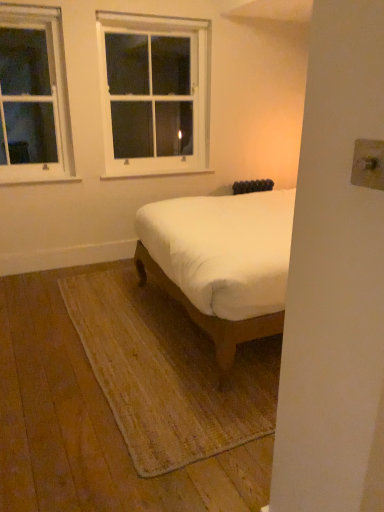
Question: Does white wood window at upper left, acting as the 1th window starting from the left, have a lesser height compared to white fabric bed at center?

Choices:
 (A) no
 (B) yes

Answer: (A)

Question: Considering the relative sizes of white wood window at upper left, which is counted as the second window, starting from the right, and white fabric bed at center in the image provided, is white wood window at upper left, which is counted as the second window, starting from the right, thinner than white fabric bed at center?

Choices:
 (A) yes
 (B) no

Answer: (A)

Question: Does white wood window at upper left, acting as the 1th window starting from the left, have a greater width compared to white fabric bed at center?

Choices:
 (A) yes
 (B) no

Answer: (B)

Question: From the image's perspective, is white wood window at upper left, which is counted as the second window, starting from the right, beneath white fabric bed at center?

Choices:
 (A) yes
 (B) no

Answer: (B)

Question: Is white wood window at upper left, acting as the 1th window starting from the left, not near white fabric bed at center?

Choices:
 (A) yes
 (B) no

Answer: (A)

Question: Considering the positions of white fabric bed at center and white wood window at upper left, acting as the 1th window starting from the left, in the image, is white fabric bed at center taller or shorter than white wood window at upper left, acting as the 1th window starting from the left,?

Choices:
 (A) tall
 (B) short

Answer: (B)

Question: From a real-world perspective, is white fabric bed at center physically located above or below white wood window at upper left, acting as the 1th window starting from the left?

Choices:
 (A) above
 (B) below

Answer: (B)

Question: In the image, is white fabric bed at center on the left side or the right side of white wood window at upper left, acting as the 1th window starting from the left?

Choices:
 (A) right
 (B) left

Answer: (A)

Question: Is white fabric bed at center in front of or behind white wood window at upper left, which is counted as the second window, starting from the right, in the image?

Choices:
 (A) behind
 (B) front

Answer: (B)

Question: From a real-world perspective, relative to white wood window at upper left, which is counted as the second window, starting from the right, is white wood window at upper center, the first window from the right, vertically above or below?

Choices:
 (A) above
 (B) below

Answer: (B)

Question: Looking at their shapes, would you say white wood window at upper center, the 2th window positioned from the left, is wider or thinner than white wood window at upper left, acting as the 1th window starting from the left?

Choices:
 (A) wide
 (B) thin

Answer: (A)

Question: Based on their sizes in the image, would you say white wood window at upper center, the first window from the right, is bigger or smaller than white wood window at upper left, acting as the 1th window starting from the left?

Choices:
 (A) small
 (B) big

Answer: (B)

Question: Does point (97, 35) appear closer or farther from the camera than point (11, 119)?

Choices:
 (A) closer
 (B) farther

Answer: (A)

Question: Is white wood window at upper left, acting as the 1th window starting from the left, in front of or behind white wood window at upper center, the first window from the right, in the image?

Choices:
 (A) behind
 (B) front

Answer: (B)

Question: Considering the positions of white wood window at upper left, acting as the 1th window starting from the left, and white wood window at upper center, the first window from the right, in the image, is white wood window at upper left, acting as the 1th window starting from the left, taller or shorter than white wood window at upper center, the first window from the right,?

Choices:
 (A) short
 (B) tall

Answer: (A)